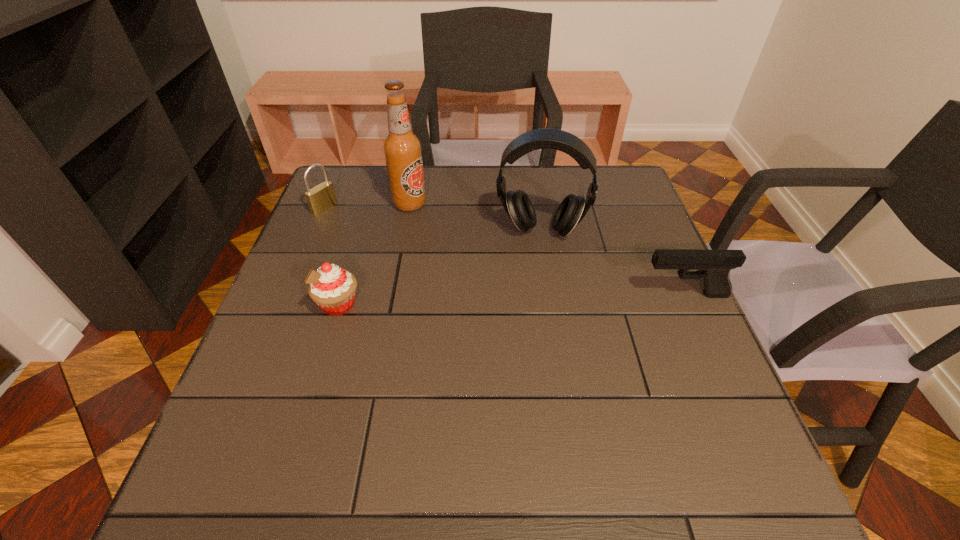
Identify the location of free space on the desktop that is between the second object from left to right and the pistol and is positioned on the front label of the tallest object. The height and width of the screenshot is (540, 960). (x=545, y=299).

Where is `free spot on the desktop that is between the cupcake and the pistol and is positioned on the ear cups of the second object from right to left`? free spot on the desktop that is between the cupcake and the pistol and is positioned on the ear cups of the second object from right to left is located at coordinates [535, 299].

You are a GUI agent. You are given a task and a screenshot of the screen. Output one action in this format:
    pyautogui.click(x=<x>, y=<y>)
    Task: Click on the free space on the desktop that is between the fourth object from right to left and the pistol and is positioned on the front-facing side of the padlock
    
    Given the screenshot: What is the action you would take?
    pyautogui.click(x=493, y=300)